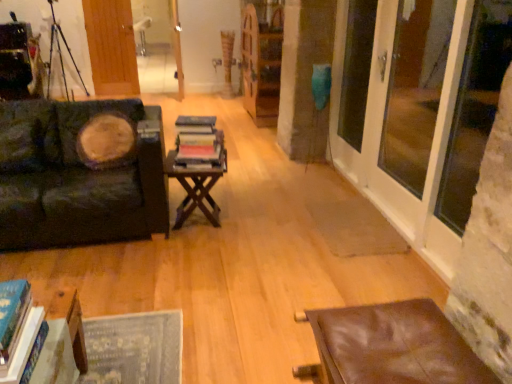
Identify the location of vacant region to the left of transparent glass door at right, the 2th window screen positioned from the front. The height and width of the screenshot is (384, 512). (339, 220).